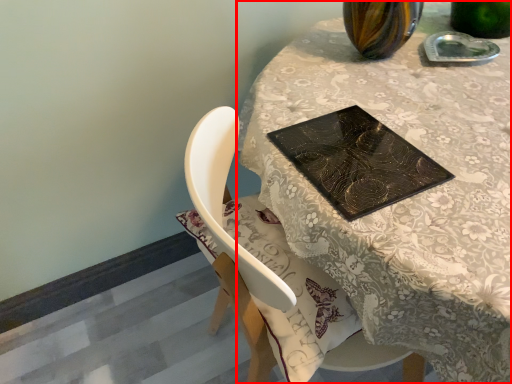
Question: From the image's perspective, considering the relative positions of table (annotated by the red box) and book cover in the image provided, where is table (annotated by the red box) located with respect to the staircase?

Choices:
 (A) above
 (B) below

Answer: (B)